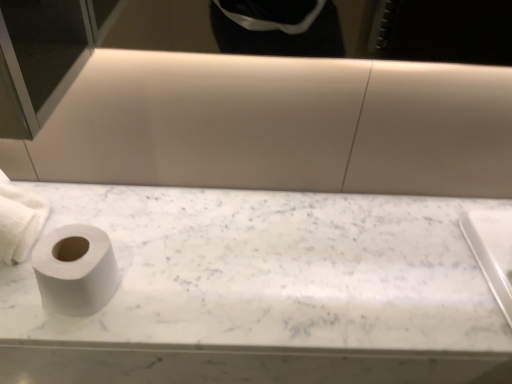
The width and height of the screenshot is (512, 384). I want to click on white matte toilet paper at left, which is the 1th toilet paper in left-to-right order, so click(x=19, y=220).

I want to click on white matte toilet paper at left, the second toilet paper in the left-to-right sequence, so click(x=75, y=270).

At what (x,y) coordinates should I click in order to perform the action: click on white marble toilet paper at left. Please return your answer as a coordinate pair (x, y). The width and height of the screenshot is (512, 384). Looking at the image, I should click on (264, 292).

Consider the image. Is white matte toilet paper at left, which appears as the 1th toilet paper when viewed from the right, not within white marble toilet paper at left?

That's correct, white matte toilet paper at left, which appears as the 1th toilet paper when viewed from the right, is outside of white marble toilet paper at left.

Is white matte toilet paper at left, the second toilet paper in the left-to-right sequence, looking in the opposite direction of white marble toilet paper at left?

That's not correct — white matte toilet paper at left, the second toilet paper in the left-to-right sequence, is not looking away from white marble toilet paper at left.

From the image's perspective, is white matte toilet paper at left, which appears as the 1th toilet paper when viewed from the right, located above or below white marble toilet paper at left?

Clearly, from the image's perspective, white matte toilet paper at left, which appears as the 1th toilet paper when viewed from the right, is above white marble toilet paper at left.

Which toilet paper is the 1st one when counting from the left side of the white marble toilet paper at left? Please provide its 2D coordinates.

[(75, 270)]

How far apart are white matte toilet paper at left, which is the 1th toilet paper in left-to-right order, and white matte toilet paper at left, which appears as the 1th toilet paper when viewed from the right?

11.62 centimeters.

From the image's perspective, is white matte toilet paper at left, which is the 1th toilet paper in left-to-right order, below white matte toilet paper at left, which appears as the 1th toilet paper when viewed from the right?

No, from the image's perspective, white matte toilet paper at left, which is the 1th toilet paper in left-to-right order, is not below white matte toilet paper at left, which appears as the 1th toilet paper when viewed from the right.

Looking at this image, which is closer, (9, 190) or (69, 245)?

Point (9, 190).

Considering the relative sizes of white matte toilet paper at left, the second toilet paper from the right, and white matte toilet paper at left, which appears as the 1th toilet paper when viewed from the right, in the image provided, is white matte toilet paper at left, the second toilet paper from the right, wider than white matte toilet paper at left, which appears as the 1th toilet paper when viewed from the right,?

Correct, the width of white matte toilet paper at left, the second toilet paper from the right, exceeds that of white matte toilet paper at left, which appears as the 1th toilet paper when viewed from the right.

From the image's perspective, is white marble toilet paper at left located above white matte toilet paper at left, which appears as the 1th toilet paper when viewed from the right?

No, from the image's perspective, white marble toilet paper at left is not on top of white matte toilet paper at left, which appears as the 1th toilet paper when viewed from the right.

Is white marble toilet paper at left to the left of white matte toilet paper at left, the second toilet paper in the left-to-right sequence, from the viewer's perspective?

No.

Between point (370, 368) and point (110, 271), which one is positioned in front?

The point (370, 368) is closer to the camera.

The width and height of the screenshot is (512, 384). I want to click on the 1st toilet paper positioned above the white marble toilet paper at left (from a real-world perspective), so click(75, 270).

From a real-world perspective, who is located lower, white matte toilet paper at left, the second toilet paper from the right, or white marble toilet paper at left?

white marble toilet paper at left is physically lower.

Which of these two, white matte toilet paper at left, which is the 1th toilet paper in left-to-right order, or white marble toilet paper at left, stands shorter?

Standing shorter between the two is white marble toilet paper at left.

How different are the orientations of white matte toilet paper at left, the second toilet paper from the right, and white marble toilet paper at left in degrees?

→ The facing directions of white matte toilet paper at left, the second toilet paper from the right, and white marble toilet paper at left are 0.279 degrees apart.

Which point is more forward, [33,217] or [185,322]?

Point [185,322]

Is white matte toilet paper at left, the second toilet paper in the left-to-right sequence, not near white matte toilet paper at left, which is the 1th toilet paper in left-to-right order?

No, white matte toilet paper at left, the second toilet paper in the left-to-right sequence, is not far from white matte toilet paper at left, which is the 1th toilet paper in left-to-right order.

Is white matte toilet paper at left, which appears as the 1th toilet paper when viewed from the right, in front of white matte toilet paper at left, which is the 1th toilet paper in left-to-right order?

Yes, the depth of white matte toilet paper at left, which appears as the 1th toilet paper when viewed from the right, is less than that of white matte toilet paper at left, which is the 1th toilet paper in left-to-right order.

From a real-world perspective, who is located higher, white matte toilet paper at left, the second toilet paper in the left-to-right sequence, or white matte toilet paper at left, which is the 1th toilet paper in left-to-right order?

From a 3D spatial view, white matte toilet paper at left, which is the 1th toilet paper in left-to-right order, is above.

From the image's perspective, which object appears higher, white matte toilet paper at left, the second toilet paper in the left-to-right sequence, or white matte toilet paper at left, the second toilet paper from the right?

white matte toilet paper at left, the second toilet paper from the right, appears higher in the image.

Based on their sizes in the image, would you say white marble toilet paper at left is bigger or smaller than white matte toilet paper at left, which is the 1th toilet paper in left-to-right order?

Clearly, white marble toilet paper at left is larger in size than white matte toilet paper at left, which is the 1th toilet paper in left-to-right order.

Is white marble toilet paper at left facing away from white matte toilet paper at left, the second toilet paper from the right?

white marble toilet paper at left does not have its back to white matte toilet paper at left, the second toilet paper from the right.

Which object is wider, white marble toilet paper at left or white matte toilet paper at left, which is the 1th toilet paper in left-to-right order?

white marble toilet paper at left.

Locate an element on the screen. counter top on the right of white matte toilet paper at left, the second toilet paper in the left-to-right sequence is located at coordinates (264, 292).

Where is `toilet paper above the white matte toilet paper at left, the second toilet paper in the left-to-right sequence (from a real-world perspective)`? Image resolution: width=512 pixels, height=384 pixels. toilet paper above the white matte toilet paper at left, the second toilet paper in the left-to-right sequence (from a real-world perspective) is located at coordinates (19, 220).

Considering their positions, is white matte toilet paper at left, the second toilet paper in the left-to-right sequence, positioned closer to white matte toilet paper at left, the second toilet paper from the right, than white marble toilet paper at left?

Based on the image, white matte toilet paper at left, the second toilet paper in the left-to-right sequence, appears to be nearer to white matte toilet paper at left, the second toilet paper from the right.

Based on their spatial positions, is white matte toilet paper at left, which appears as the 1th toilet paper when viewed from the right, or white matte toilet paper at left, the second toilet paper from the right, closer to white marble toilet paper at left?

white matte toilet paper at left, which appears as the 1th toilet paper when viewed from the right, is closer to white marble toilet paper at left.

Based on their spatial positions, is white matte toilet paper at left, the second toilet paper from the right, or white marble toilet paper at left closer to white matte toilet paper at left, the second toilet paper in the left-to-right sequence?

white matte toilet paper at left, the second toilet paper from the right, is closer to white matte toilet paper at left, the second toilet paper in the left-to-right sequence.

From the picture: From the image, which object appears to be nearer to white matte toilet paper at left, the second toilet paper in the left-to-right sequence, white marble toilet paper at left or white matte toilet paper at left, the second toilet paper from the right?

white matte toilet paper at left, the second toilet paper from the right, lies closer to white matte toilet paper at left, the second toilet paper in the left-to-right sequence, than the other object.

Considering their positions, is white matte toilet paper at left, the second toilet paper from the right, positioned further to white marble toilet paper at left than white matte toilet paper at left, the second toilet paper in the left-to-right sequence?

Based on the image, white matte toilet paper at left, the second toilet paper from the right, appears to be further to white marble toilet paper at left.

From the image, which object appears to be nearer to white matte toilet paper at left, which is the 1th toilet paper in left-to-right order, white marble toilet paper at left or white matte toilet paper at left, the second toilet paper in the left-to-right sequence?

The object closer to white matte toilet paper at left, which is the 1th toilet paper in left-to-right order, is white matte toilet paper at left, the second toilet paper in the left-to-right sequence.

Where is `toilet paper situated between white matte toilet paper at left, which is the 1th toilet paper in left-to-right order, and white marble toilet paper at left from left to right`? This screenshot has width=512, height=384. toilet paper situated between white matte toilet paper at left, which is the 1th toilet paper in left-to-right order, and white marble toilet paper at left from left to right is located at coordinates (75, 270).